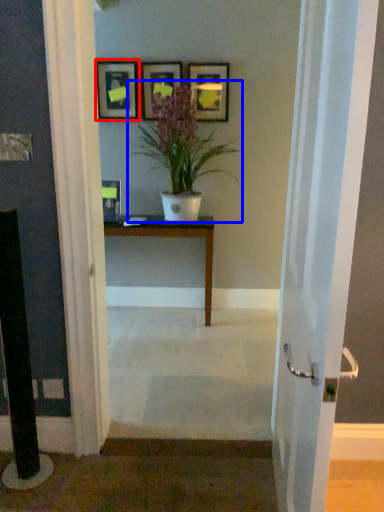
Question: Among these objects, which one is farthest to the camera, picture frame (highlighted by a red box) or houseplant (highlighted by a blue box)?

Choices:
 (A) picture frame
 (B) houseplant

Answer: (A)